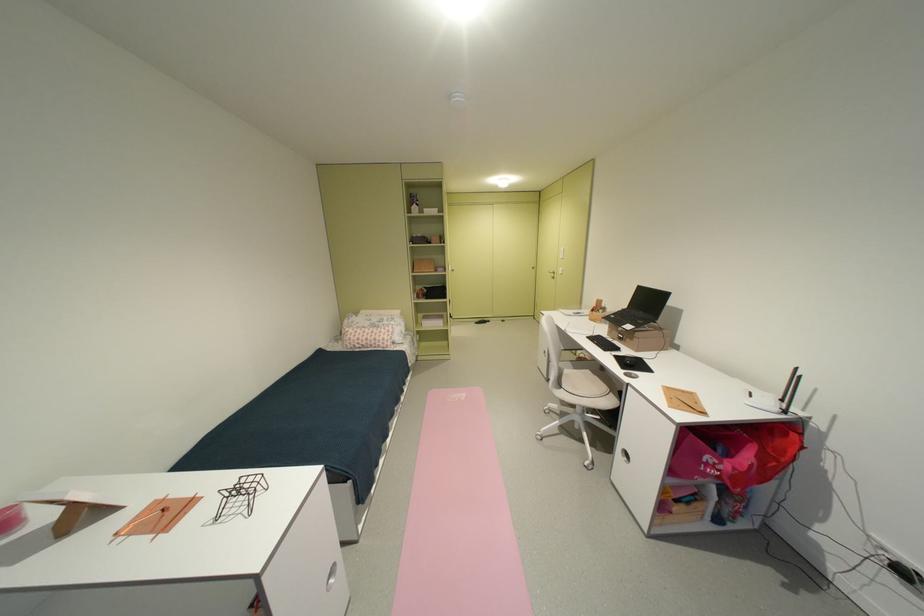
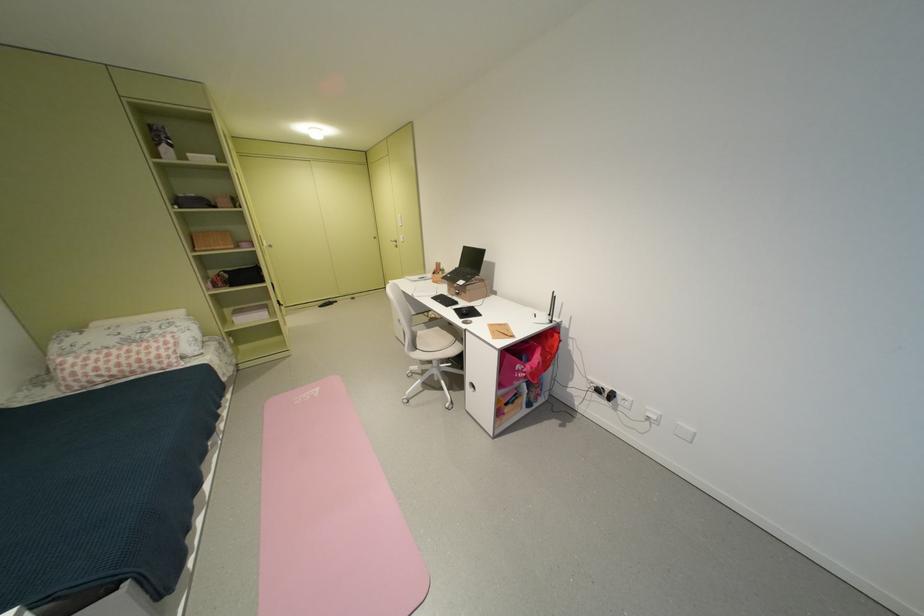
In the second image, find the point that corresponds to [760,394] in the first image.

(544, 315)